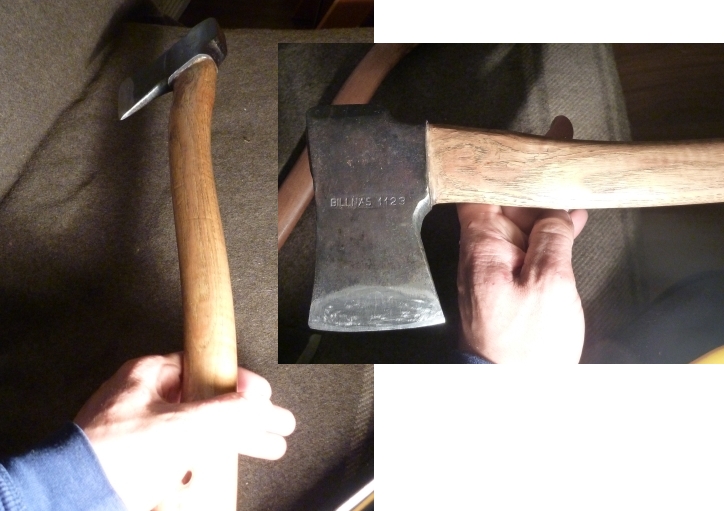
Find the location of a particular element. sofa is located at coordinates (253, 164).